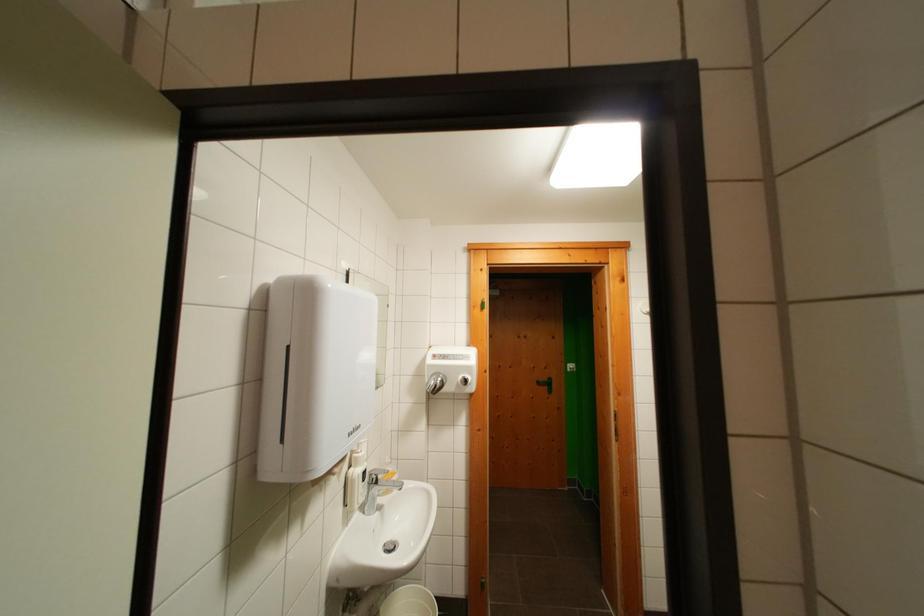
Where would you lift the faucet handle? Please return your answer as a coordinate pair (x, y).

(380, 472)